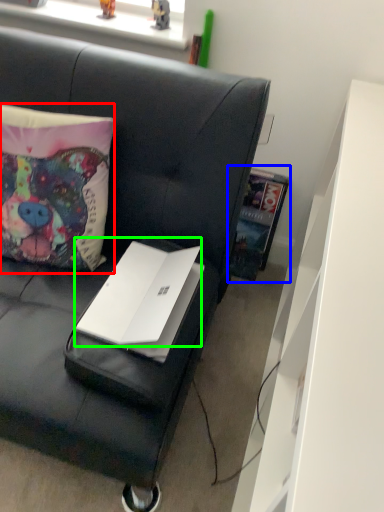
Question: Which object is the closest to the pillow (highlighted by a red box)? Choose among these: book (highlighted by a blue box) or laptop (highlighted by a green box).

Choices:
 (A) book
 (B) laptop

Answer: (B)